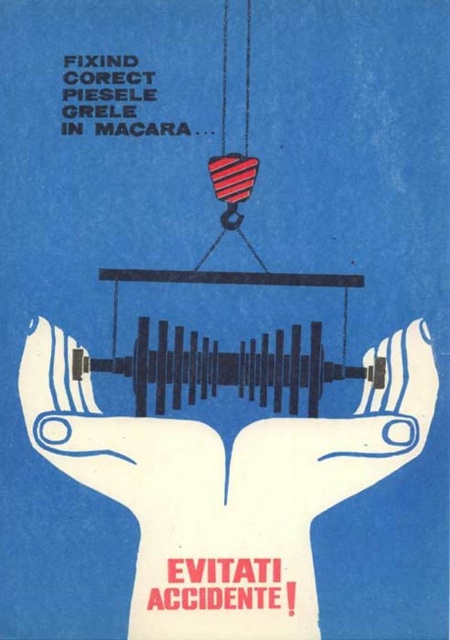
Question: Which object appears closest to the camera in this image?

Choices:
 (A) white matte hand at center
 (B) white matte hands at center

Answer: (B)

Question: Can you confirm if white matte hands at center is positioned to the right of white matte hand at center?

Choices:
 (A) no
 (B) yes

Answer: (B)

Question: Does white matte hands at center have a greater width compared to white matte hand at center?

Choices:
 (A) no
 (B) yes

Answer: (B)

Question: Does white matte hands at center have a larger size compared to white matte hand at center?

Choices:
 (A) yes
 (B) no

Answer: (A)

Question: Which object appears closest to the camera in this image?

Choices:
 (A) white matte hand at center
 (B) white matte hands at center

Answer: (B)